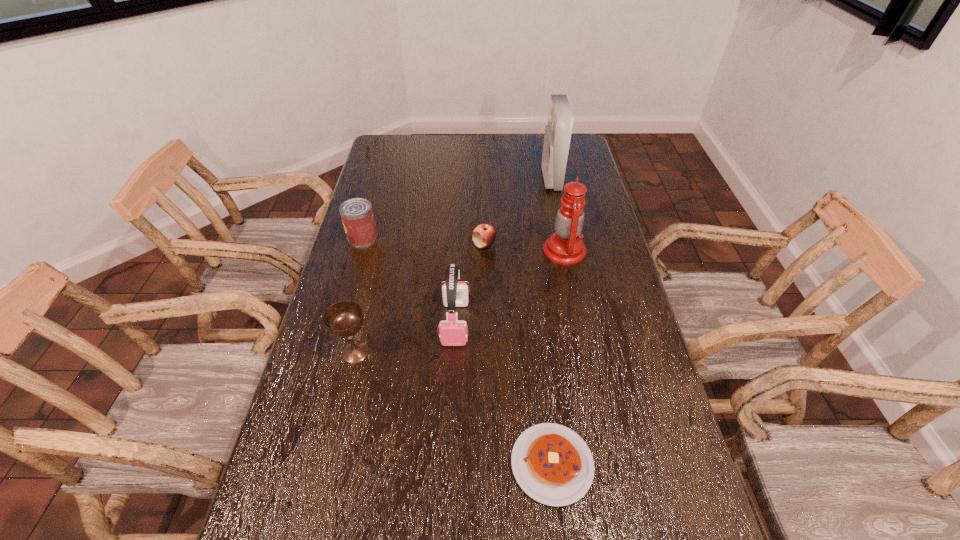
Identify the location of free space located on the front-facing side of the first-aid kit. This screenshot has width=960, height=540. (451, 179).

Identify the location of vacant space located 0.180m on the front-facing side of the first-aid kit. This screenshot has height=540, width=960. (499, 179).

Locate an element on the screen. vacant space located 0.120m on the front-facing side of the first-aid kit is located at coordinates (514, 179).

The width and height of the screenshot is (960, 540). Find the location of `vacant region located 0.130m on the left of the oil lamp`. vacant region located 0.130m on the left of the oil lamp is located at coordinates (505, 250).

This screenshot has width=960, height=540. Identify the location of vacant region located 0.160m on the outer surface of the earphone. (451, 399).

The height and width of the screenshot is (540, 960). Identify the location of vacant area situated on the back of the chalice. pos(380,248).

At what (x,y) coordinates should I click in order to perform the action: click on vacant region located on the front of the can. Please return your answer as a coordinate pair (x, y). The height and width of the screenshot is (540, 960). Looking at the image, I should click on (356, 261).

Locate an element on the screen. This screenshot has height=540, width=960. vacant area situated 0.080m on the left of the apple is located at coordinates (449, 245).

Identify the location of vacant space positioned 0.180m on the right of the pancake. This screenshot has width=960, height=540. (671, 464).

You are a GUI agent. You are given a task and a screenshot of the screen. Output one action in this format:
    pyautogui.click(x=<x>, y=<y>)
    Task: Click on the chalice that is at the left edge
    
    Given the screenshot: What is the action you would take?
    pyautogui.click(x=344, y=319)